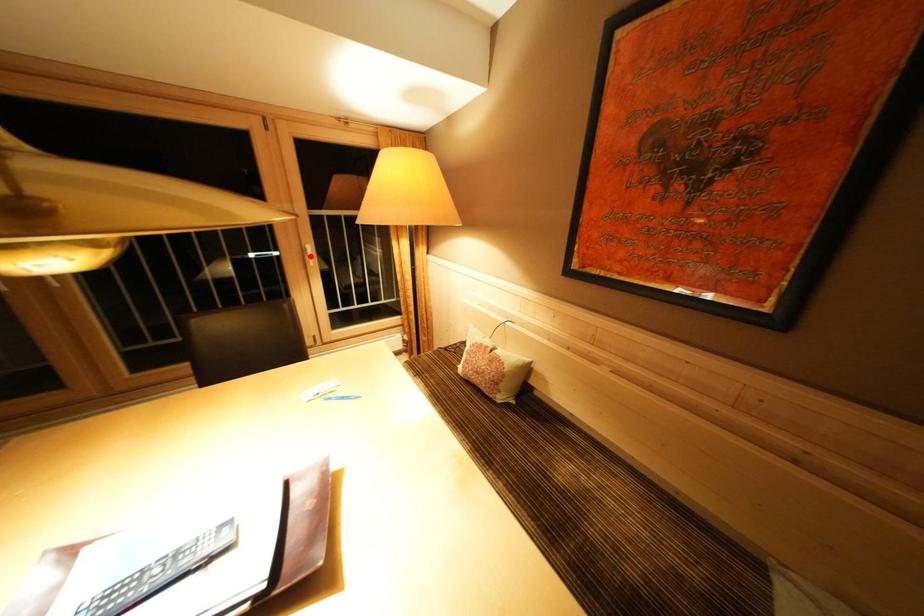
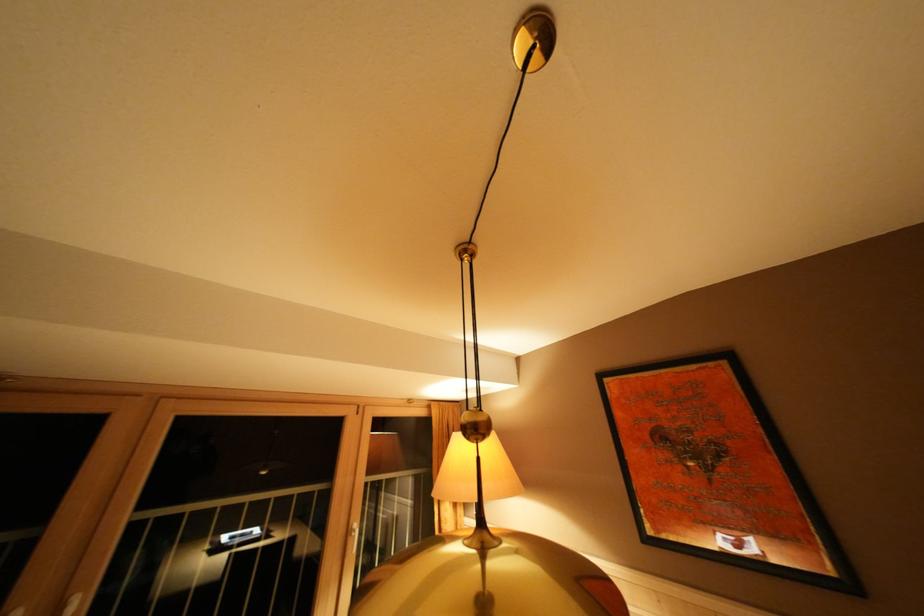
Locate, in the second image, the point that corresponds to the highlighted location in the first image.

(355, 537)